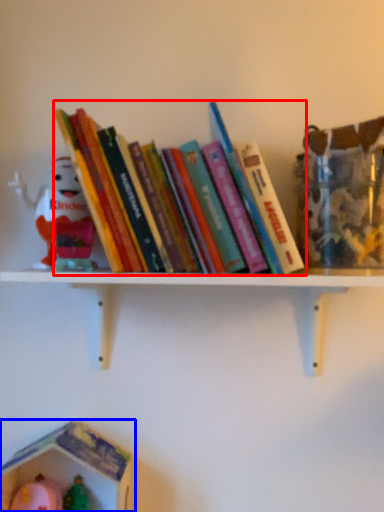
Question: Which point is further to the camera, book (highlighted by a red box) or toy (highlighted by a blue box)?

Choices:
 (A) book
 (B) toy

Answer: (B)